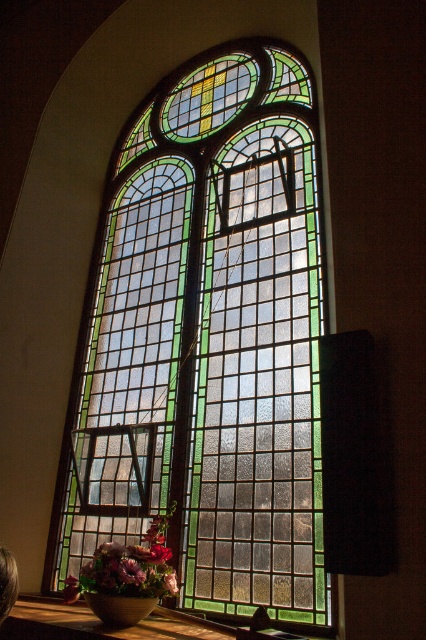
Question: Which point appears farthest from the camera in this image?

Choices:
 (A) (104, 541)
 (B) (319, 552)

Answer: (A)

Question: Is stained glass window at center above matte floral arrangement at lower left?

Choices:
 (A) yes
 (B) no

Answer: (A)

Question: Is stained glass window at center bigger than matte floral arrangement at lower left?

Choices:
 (A) yes
 (B) no

Answer: (A)

Question: Where is stained glass window at center located in relation to matte floral arrangement at lower left in the image?

Choices:
 (A) right
 (B) left

Answer: (A)